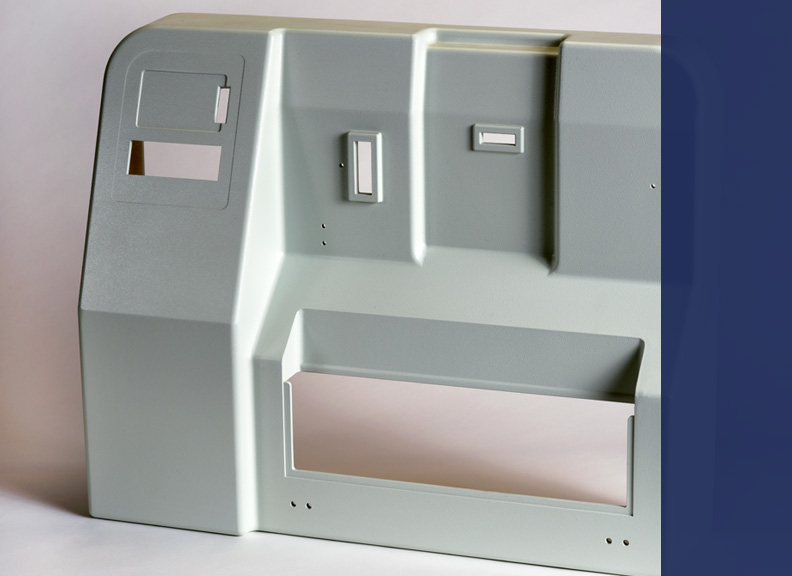
At what (x,y) coordinates should I click in order to perform the action: click on frames. Please return your answer as a coordinate pair (x, y). Looking at the image, I should click on (377, 155), (227, 146), (505, 128).